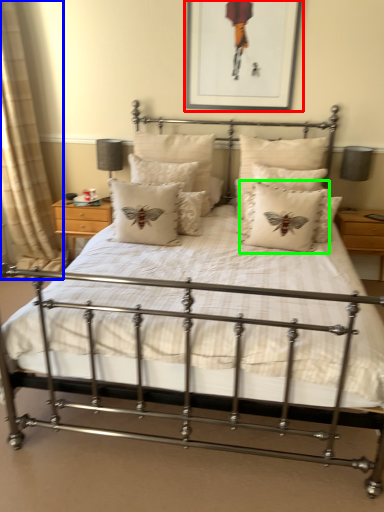
Question: Estimate the real-world distances between objects in this image. Which object is farther from picture frame (highlighted by a red box), curtain (highlighted by a blue box) or pillow (highlighted by a green box)?

Choices:
 (A) curtain
 (B) pillow

Answer: (A)